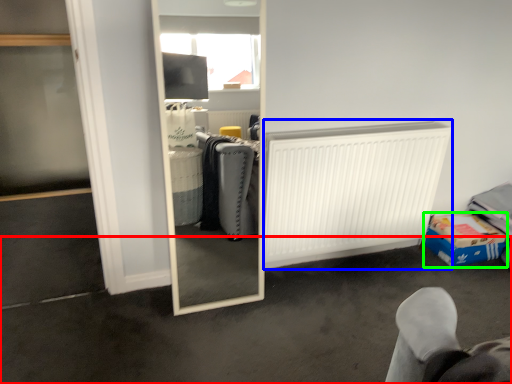
Question: Which object is the closest to the concrete (highlighted by a red box)? Choose among these: radiator (highlighted by a blue box) or cardboard box (highlighted by a green box).

Choices:
 (A) radiator
 (B) cardboard box

Answer: (A)